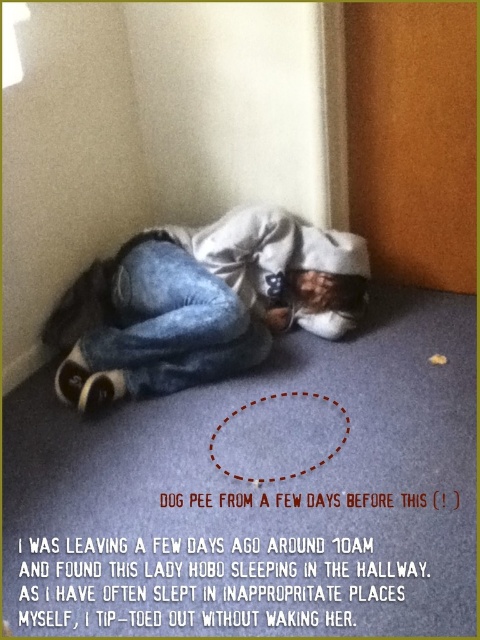
You are a cleaning staff member who needs to clean the stain near the person lying on the dark blue carpet. The stain is between the faded denim jacket at lower right and the denim at lower left. How far apart are these two denim items?

The faded denim jacket at lower right and the denim at lower left are 5.02 centimeters apart.

You are a delivery person who needs to place a small package on the faded denim jacket at lower right. According to the coordinates provided, where exactly should you place the package?

The faded denim jacket at lower right is located at coordinates point (203, 304), so you should place the package there.

You are standing in the hallway and see the point at coordinates (203, 304). What object is located at that point?

The point at coordinates (203, 304) indicates a faded denim jacket at lower right.